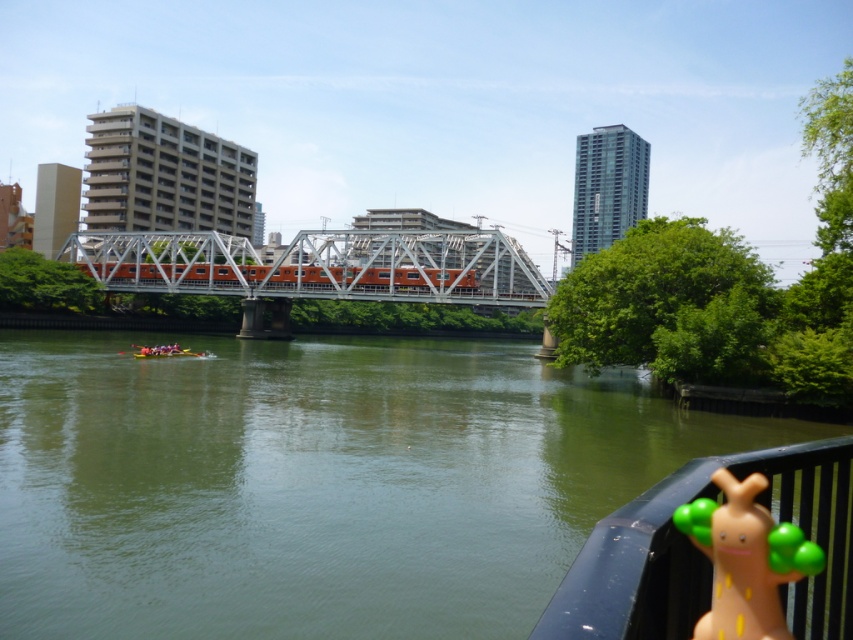
You are standing at the riverside and see the green smooth water at center and the green rubber toy at lower right. Which object is nearer to you?

The green smooth water at center is closer to the viewer than the green rubber toy at lower right.

From the picture: You are standing at the edge of the riverside and want to reach the green smooth water at center. Which direction should you move in to get there?

The green smooth water at center is located at point (x=316, y=483), so you should move towards the center of the image to reach it.

Looking at this image, you are a photographer standing at the riverside. You want to capture a photo that includes both the green smooth water at center and the orange metallic bridge at center. Which object should you adjust your camera to focus on first to ensure both are in frame?

The green smooth water at center is positioned on the right side of orange metallic bridge at center. To include both in the frame, focus on the orange metallic bridge at center first since it is on the left, then adjust to include the green smooth water at center on the right.